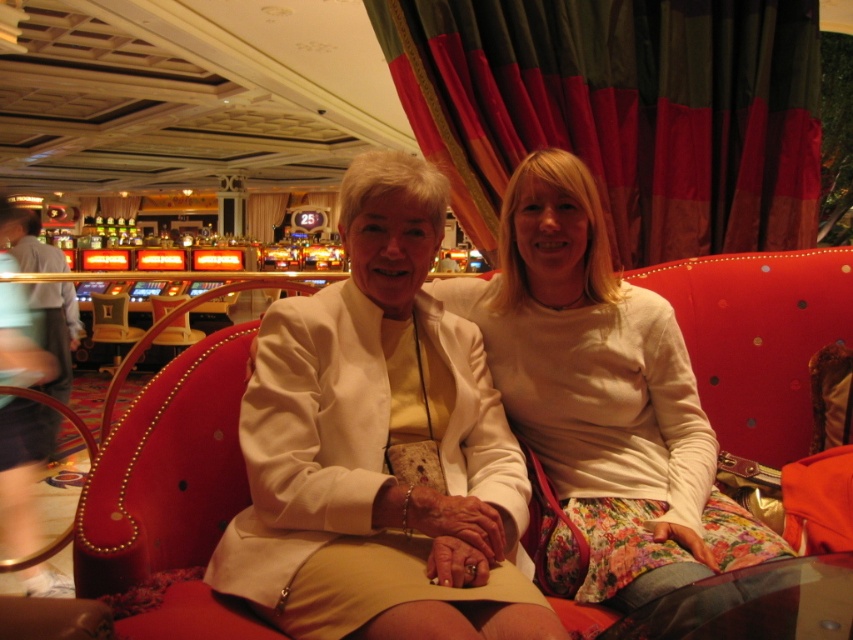
Does velvet-like curtain at upper center come behind white cotton sweater at center?

That is True.

In the scene shown: Which of these two, velvet-like curtain at upper center or white cotton sweater at center, stands shorter?

With less height is white cotton sweater at center.

Measure the distance between velvet-like curtain at upper center and camera.

They are 1.96 meters apart.

Identify the location of velvet-like curtain at upper center. The width and height of the screenshot is (853, 640). (622, 112).

Which of these two, white cotton sweater at center or metallic silver armchair at center, stands shorter?

metallic silver armchair at center

Between white cotton sweater at center and metallic silver armchair at center, which one is positioned lower?

white cotton sweater at center is below.

Who is more distant from viewer, [540,538] or [112,292]?

The point [112,292] is behind.

At what (x,y) coordinates should I click in order to perform the action: click on white cotton sweater at center. Please return your answer as a coordinate pair (x, y). Looking at the image, I should click on (601, 401).

Between point (653, 256) and point (129, 340), which one is positioned in front?

Point (653, 256)

Locate an element on the screen. Image resolution: width=853 pixels, height=640 pixels. velvet-like curtain at upper center is located at coordinates (622, 112).

Locate an element on the screen. The width and height of the screenshot is (853, 640). velvet-like curtain at upper center is located at coordinates (622, 112).

I want to click on velvet-like curtain at upper center, so click(622, 112).